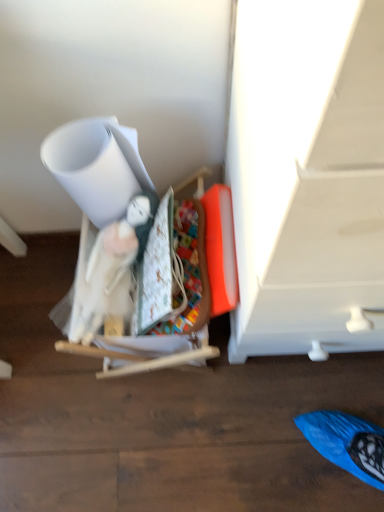
You are a GUI agent. You are given a task and a screenshot of the screen. Output one action in this format:
    pyautogui.click(x=<x>, y=<y>)
    Task: Click on the free space in front of white fabric doll at left
    
    Given the screenshot: What is the action you would take?
    pyautogui.click(x=164, y=439)